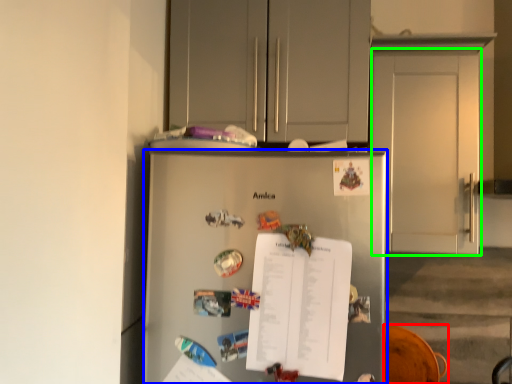
Question: Which is nearer to the swivel chair (highlighted by a red box)? refrigerator (highlighted by a blue box) or door (highlighted by a green box).

Choices:
 (A) refrigerator
 (B) door

Answer: (B)